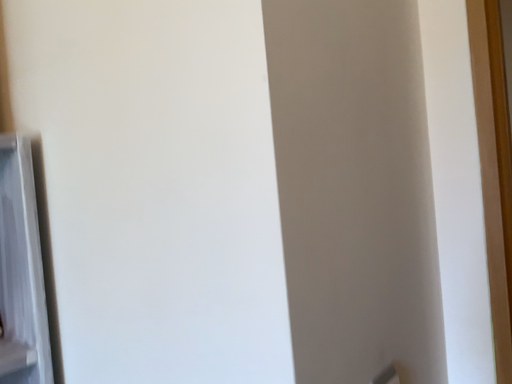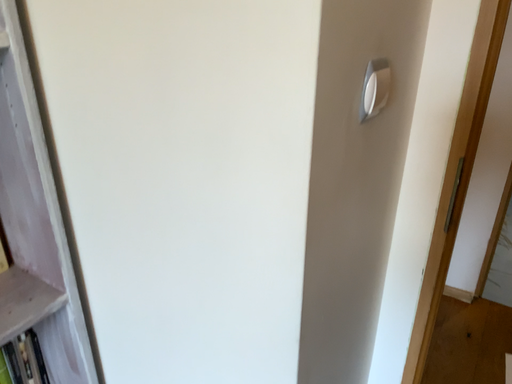
Question: Which way did the camera rotate in the video?

Choices:
 (A) rotated upward
 (B) rotated downward

Answer: (B)